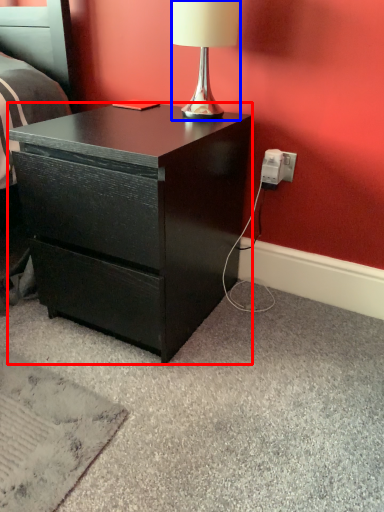
Question: Which of the following is the farthest to the observer, desk (highlighted by a red box) or lamp (highlighted by a blue box)?

Choices:
 (A) desk
 (B) lamp

Answer: (B)